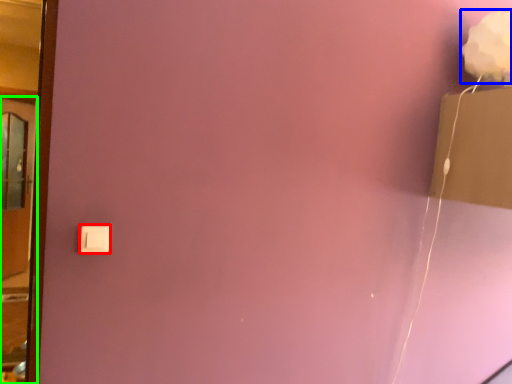
Question: Which is farther away from light switch (highlighted by a red box)? flower (highlighted by a blue box) or door (highlighted by a green box)?

Choices:
 (A) flower
 (B) door

Answer: (B)